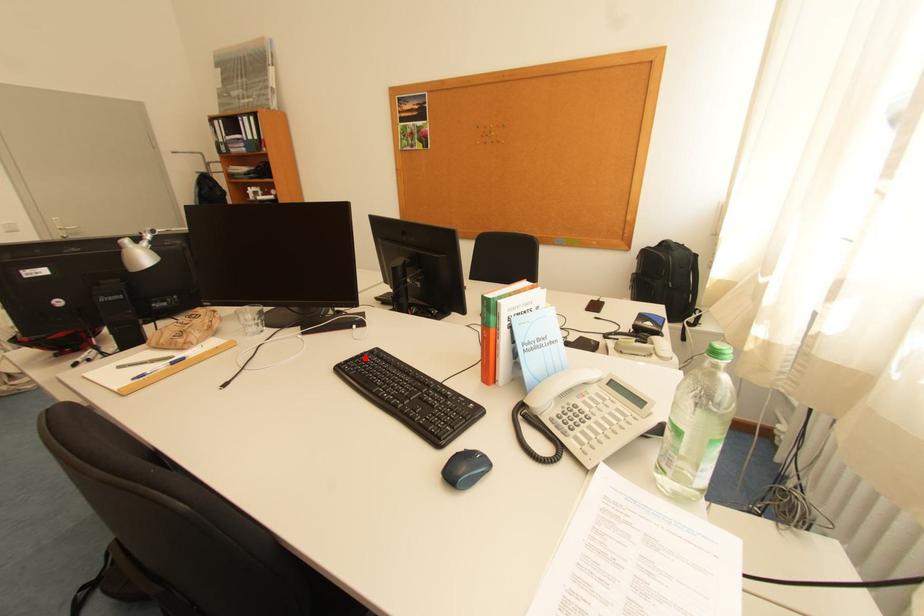
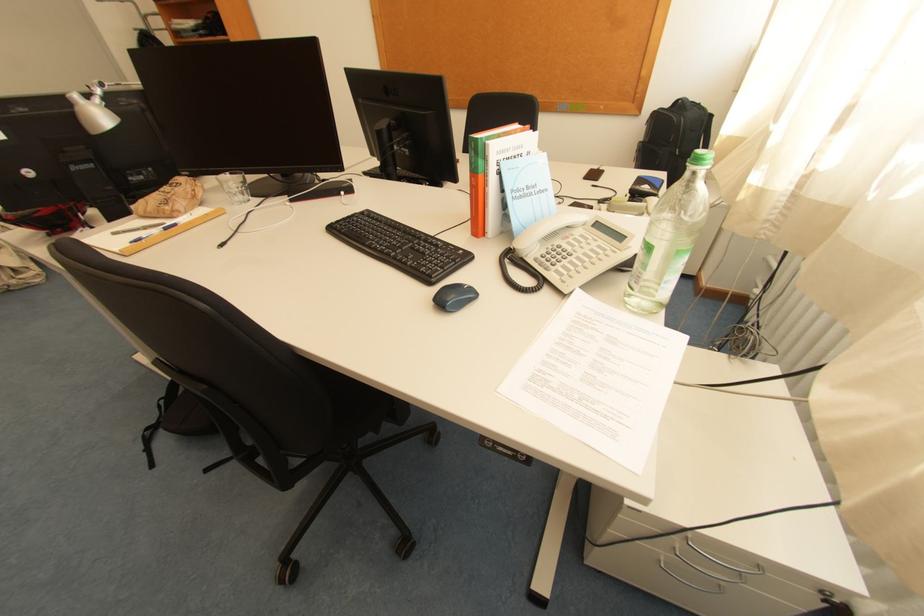
The point at the highlighted location is marked in the first image. Where is the corresponding point in the second image?

(356, 219)